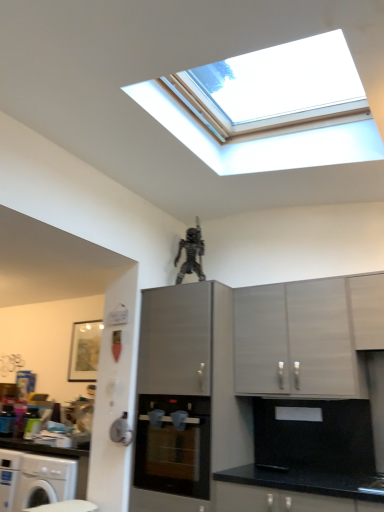
Question: From a real-world perspective, is white matte cabinet at upper right, arranged as the third cabinetry when viewed from the left, physically located above or below matte gray cabinet at center, which appears as the 2th cabinetry when viewed from the right?

Choices:
 (A) above
 (B) below

Answer: (A)

Question: Do you think white matte cabinet at upper right, arranged as the third cabinetry when viewed from the left, is within matte gray cabinet at center, which appears as the 2th cabinetry when viewed from the right, or outside of it?

Choices:
 (A) inside
 (B) outside

Answer: (B)

Question: Which is nearer to the matte gray cabinet at center, the second cabinetry positioned from the left?

Choices:
 (A) metallic figure at upper center
 (B) satin grey cabinet at center, the 1th cabinetry positioned from the left
 (C) white matte cabinet at upper right, arranged as the third cabinetry when viewed from the left
 (D) matte black oven at center

Answer: (C)

Question: Which object is positioned closest to the white matte cabinet at upper right, arranged as the third cabinetry when viewed from the left?

Choices:
 (A) matte gray cabinet at center, which appears as the 2th cabinetry when viewed from the right
 (B) matte black oven at center
 (C) satin grey cabinet at center, positioned as the third cabinetry in right-to-left order
 (D) metallic figure at upper center

Answer: (A)